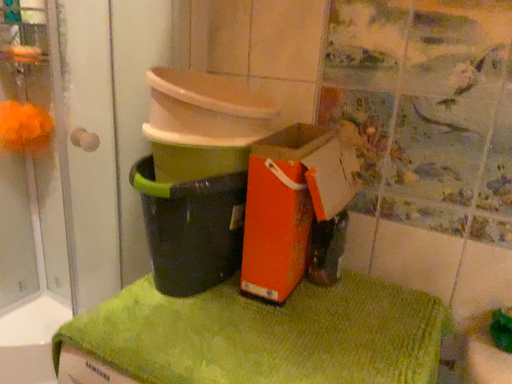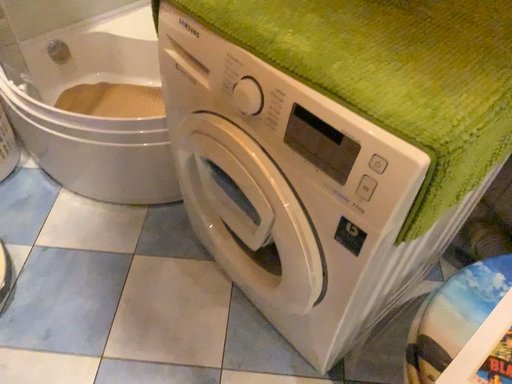
Question: How did the camera likely rotate when shooting the video?

Choices:
 (A) rotated downward
 (B) rotated upward

Answer: (A)